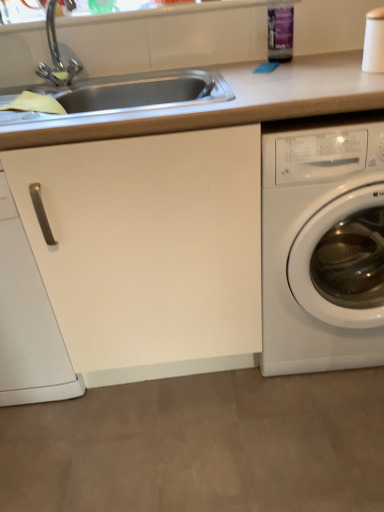
Measure the distance between point (4, 284) and camera.

Point (4, 284) and camera are 3.82 feet apart from each other.

Where is `smooth beige countertop at center`? smooth beige countertop at center is located at coordinates (150, 250).

Measure the distance between smooth beige countertop at center and camera.

The depth of smooth beige countertop at center is 36.14 inches.

Identify the location of white glossy washing machine at right. Image resolution: width=384 pixels, height=512 pixels. (323, 249).

From a real-world perspective, who is located lower, smooth beige countertop at center or white matte cabinet handle at left?

white matte cabinet handle at left.

Is smooth beige countertop at center in front of or behind white matte cabinet handle at left in the image?

In the image, smooth beige countertop at center appears in front of white matte cabinet handle at left.

Is smooth beige countertop at center inside or outside of white matte cabinet handle at left?

smooth beige countertop at center is located beyond the bounds of white matte cabinet handle at left.

Is smooth beige countertop at center wider or thinner than white matte cabinet handle at left?

Considering their sizes, smooth beige countertop at center looks broader than white matte cabinet handle at left.

How different are the orientations of white glossy washing machine at right and smooth beige countertop at center in degrees?

They differ by 0.477 degrees in their facing directions.

Is white glossy washing machine at right facing away from smooth beige countertop at center?

Yes, white glossy washing machine at right's orientation is away from smooth beige countertop at center.

From the image's perspective, which one is positioned lower, white glossy washing machine at right or smooth beige countertop at center?

From the image's view, smooth beige countertop at center is below.

Based on the photo, visually, is white glossy washing machine at right positioned to the left or to the right of smooth beige countertop at center?

From the image, it's evident that white glossy washing machine at right is to the right of smooth beige countertop at center.

Is smooth beige countertop at center not within white glossy washing machine at right?

Actually, smooth beige countertop at center is at least partially inside white glossy washing machine at right.

Is smooth beige countertop at center turned away from white glossy washing machine at right?

Yes, smooth beige countertop at center's orientation is away from white glossy washing machine at right.

From the image's perspective, which one is positioned lower, smooth beige countertop at center or white glossy washing machine at right?

smooth beige countertop at center is shown below in the image.

Which object is thinner, smooth beige countertop at center or white glossy washing machine at right?

With smaller width is smooth beige countertop at center.

Can you tell me how much white glossy washing machine at right and white matte cabinet handle at left differ in facing direction?

The facing directions of white glossy washing machine at right and white matte cabinet handle at left are 0.477 degrees apart.

Would you say white matte cabinet handle at left is part of white glossy washing machine at right's contents?

No, white matte cabinet handle at left is not inside white glossy washing machine at right.

From the image's perspective, is white glossy washing machine at right located beneath white matte cabinet handle at left?

Actually, white glossy washing machine at right appears above white matte cabinet handle at left in the image.

Can you confirm if white glossy washing machine at right is shorter than white matte cabinet handle at left?

Yes, white glossy washing machine at right is shorter than white matte cabinet handle at left.

Is the surface of white matte cabinet handle at left in direct contact with smooth beige countertop at center?

white matte cabinet handle at left and smooth beige countertop at center are not in contact.

Is white matte cabinet handle at left facing away from smooth beige countertop at center?

Yes.

From a real-world perspective, who is located lower, white matte cabinet handle at left or smooth beige countertop at center?

white matte cabinet handle at left.

Is white matte cabinet handle at left situated inside white glossy washing machine at right or outside?

white matte cabinet handle at left cannot be found inside white glossy washing machine at right.

Which of these two, white matte cabinet handle at left or white glossy washing machine at right, is bigger?

white glossy washing machine at right.

From the picture: From the image's perspective, who appears lower, white matte cabinet handle at left or white glossy washing machine at right?

From the image's view, white matte cabinet handle at left is below.

The image size is (384, 512). What are the coordinates of `dish washer below the smooth beige countertop at center (from a real-world perspective)` in the screenshot? It's located at (28, 322).

In the image, there is a white glossy washing machine at right. Find the location of `counter top below it (from the image's perspective)`. counter top below it (from the image's perspective) is located at coordinates [150, 250].

Which object lies further to the anchor point white matte cabinet handle at left, smooth beige countertop at center or white glossy washing machine at right?

white glossy washing machine at right.

Looking at the image, which one is located closer to white matte cabinet handle at left, white glossy washing machine at right or smooth beige countertop at center?

smooth beige countertop at center is positioned closer to the anchor white matte cabinet handle at left.

When comparing their distances from smooth beige countertop at center, does white glossy washing machine at right or white matte cabinet handle at left seem closer?

white glossy washing machine at right is positioned closer to the anchor smooth beige countertop at center.

When comparing their distances from white glossy washing machine at right, does smooth beige countertop at center or white matte cabinet handle at left seem closer?

smooth beige countertop at center is positioned closer to the anchor white glossy washing machine at right.

Looking at the image, which one is located closer to white glossy washing machine at right, white matte cabinet handle at left or smooth beige countertop at center?

Among the two, smooth beige countertop at center is located nearer to white glossy washing machine at right.

Based on the photo, looking at the image, which one is located closer to smooth beige countertop at center, white matte cabinet handle at left or white glossy washing machine at right?

white glossy washing machine at right is closer to smooth beige countertop at center.

The image size is (384, 512). Find the location of `counter top situated between white matte cabinet handle at left and white glossy washing machine at right from left to right`. counter top situated between white matte cabinet handle at left and white glossy washing machine at right from left to right is located at coordinates (150, 250).